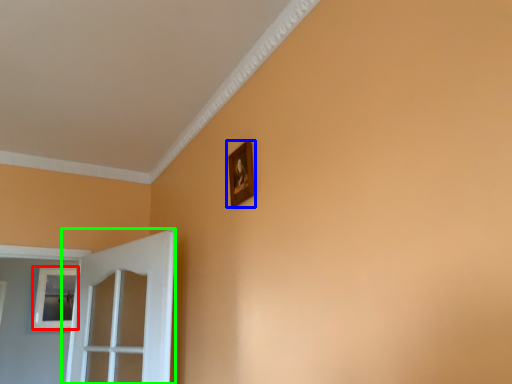
Question: Considering the real-world distances, which object is farthest from picture frame (highlighted by a red box)? picture frame (highlighted by a blue box) or door (highlighted by a green box)?

Choices:
 (A) picture frame
 (B) door

Answer: (A)